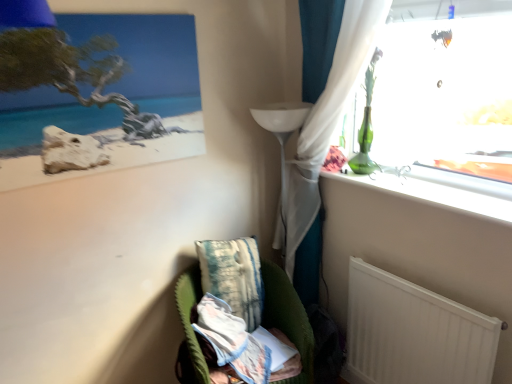
The height and width of the screenshot is (384, 512). Describe the element at coordinates (413, 333) in the screenshot. I see `white matte radiator at lower right` at that location.

Locate an element on the screen. The height and width of the screenshot is (384, 512). matte wooden picture frame at upper left is located at coordinates (99, 93).

At what (x,y) coordinates should I click in order to perform the action: click on velvet green armchair at lower center. Please return your answer as a coordinate pair (x, y). Looking at the image, I should click on (288, 317).

Where is `white matte radiator at lower right`? This screenshot has width=512, height=384. white matte radiator at lower right is located at coordinates (413, 333).

Is velvet green armchair at lower center located outside white matte radiator at lower right?

Yes, velvet green armchair at lower center is outside of white matte radiator at lower right.

Consider the image. Which of these two, velvet green armchair at lower center or white matte radiator at lower right, is wider?

With larger width is velvet green armchair at lower center.

Identify the location of radiator on the right of velvet green armchair at lower center. (413, 333).

Can you confirm if velvet green armchair at lower center is shorter than white matte radiator at lower right?

In fact, velvet green armchair at lower center may be taller than white matte radiator at lower right.

Is point (255, 276) behind point (95, 74)?

Yes, it is behind point (95, 74).

Considering the relative positions of textured teal pillow at lower center and matte wooden picture frame at upper left in the image provided, is textured teal pillow at lower center to the left of matte wooden picture frame at upper left from the viewer's perspective?

No, textured teal pillow at lower center is not to the left of matte wooden picture frame at upper left.

Is textured teal pillow at lower center far from matte wooden picture frame at upper left?

textured teal pillow at lower center is near matte wooden picture frame at upper left, not far away.

Is textured teal pillow at lower center spatially inside matte wooden picture frame at upper left, or outside of it?

textured teal pillow at lower center is not enclosed by matte wooden picture frame at upper left.

Can you tell me how much textured teal pillow at lower center and velvet green armchair at lower center differ in facing direction?

4.88 degrees separate the facing orientations of textured teal pillow at lower center and velvet green armchair at lower center.

In terms of width, does textured teal pillow at lower center look wider or thinner when compared to velvet green armchair at lower center?

Considering their sizes, textured teal pillow at lower center looks slimmer than velvet green armchair at lower center.

This screenshot has width=512, height=384. I want to click on pillow above the velvet green armchair at lower center (from a real-world perspective), so click(234, 276).

Which is more to the left, textured teal pillow at lower center or velvet green armchair at lower center?

From the viewer's perspective, textured teal pillow at lower center appears more on the left side.

The image size is (512, 384). Find the location of `radiator in front of the velvet green armchair at lower center`. radiator in front of the velvet green armchair at lower center is located at coordinates (413, 333).

Considering the relative positions of white matte radiator at lower right and velvet green armchair at lower center in the image provided, is white matte radiator at lower right in front of velvet green armchair at lower center?

Yes, it is in front of velvet green armchair at lower center.

Looking at this image, who is smaller, white matte radiator at lower right or velvet green armchair at lower center?

white matte radiator at lower right is smaller.

Measure the distance from textured teal pillow at lower center to white matte radiator at lower right.

textured teal pillow at lower center is 61.23 centimeters away from white matte radiator at lower right.

From a real-world perspective, is textured teal pillow at lower center beneath white matte radiator at lower right?

Incorrect, from a real-world perspective, textured teal pillow at lower center is higher than white matte radiator at lower right.

Can you tell me how much textured teal pillow at lower center and white matte radiator at lower right differ in facing direction?

66.8 degrees separate the facing orientations of textured teal pillow at lower center and white matte radiator at lower right.

Is textured teal pillow at lower center closer to the viewer compared to white matte radiator at lower right?

No.

Where is `pillow that is behind the white matte radiator at lower right`? pillow that is behind the white matte radiator at lower right is located at coordinates 234,276.

Is white matte radiator at lower right next to textured teal pillow at lower center and touching it?

No.

Which is nearer, (471, 334) or (241, 259)?

Positioned in front is point (471, 334).

Can we say white matte radiator at lower right lies outside textured teal pillow at lower center?

white matte radiator at lower right lies outside textured teal pillow at lower center's area.

Is point (122, 57) behind point (472, 347)?

Yes, it is behind point (472, 347).

Considering the sizes of objects matte wooden picture frame at upper left and white matte radiator at lower right in the image provided, who is bigger, matte wooden picture frame at upper left or white matte radiator at lower right?

matte wooden picture frame at upper left.

Is matte wooden picture frame at upper left not close to white matte radiator at lower right?

matte wooden picture frame at upper left is far away from white matte radiator at lower right.

From a real-world perspective, is matte wooden picture frame at upper left physically located above or below white matte radiator at lower right?

In terms of real-world spatial position, matte wooden picture frame at upper left is above white matte radiator at lower right.

The height and width of the screenshot is (384, 512). I want to click on radiator that appears in front of the velvet green armchair at lower center, so click(413, 333).

Where is `pillow below the matte wooden picture frame at upper left (from a real-world perspective)`? The height and width of the screenshot is (384, 512). pillow below the matte wooden picture frame at upper left (from a real-world perspective) is located at coordinates (234, 276).

From the image, which object appears to be farther from velvet green armchair at lower center, matte wooden picture frame at upper left or textured teal pillow at lower center?

matte wooden picture frame at upper left.

When comparing their distances from textured teal pillow at lower center, does velvet green armchair at lower center or matte wooden picture frame at upper left seem further?

matte wooden picture frame at upper left.

Considering their positions, is matte wooden picture frame at upper left positioned closer to textured teal pillow at lower center than velvet green armchair at lower center?

velvet green armchair at lower center is positioned closer to the anchor textured teal pillow at lower center.

Based on the photo, looking at the image, which one is located further to textured teal pillow at lower center, white matte radiator at lower right or matte wooden picture frame at upper left?

matte wooden picture frame at upper left.

When comparing their distances from textured teal pillow at lower center, does matte wooden picture frame at upper left or white matte radiator at lower right seem further?

Among the two, matte wooden picture frame at upper left is located further to textured teal pillow at lower center.

Estimate the real-world distances between objects in this image. Which object is closer to matte wooden picture frame at upper left, velvet green armchair at lower center or textured teal pillow at lower center?

Among the two, textured teal pillow at lower center is located nearer to matte wooden picture frame at upper left.

Based on their spatial positions, is matte wooden picture frame at upper left or textured teal pillow at lower center further from white matte radiator at lower right?

Among the two, matte wooden picture frame at upper left is located further to white matte radiator at lower right.

Which object lies further to the anchor point matte wooden picture frame at upper left, textured teal pillow at lower center or white matte radiator at lower right?

white matte radiator at lower right is positioned further to the anchor matte wooden picture frame at upper left.

Find the location of a particular element. The width and height of the screenshot is (512, 384). pillow between matte wooden picture frame at upper left and white matte radiator at lower right in the horizontal direction is located at coordinates (234, 276).

This screenshot has height=384, width=512. I want to click on pillow between matte wooden picture frame at upper left and velvet green armchair at lower center vertically, so click(234, 276).

You are a GUI agent. You are given a task and a screenshot of the screen. Output one action in this format:
    pyautogui.click(x=<x>, y=<y>)
    Task: Click on the furniture between textured teal pillow at lower center and white matte radiator at lower right from left to right
    Image resolution: width=512 pixels, height=384 pixels.
    Given the screenshot: What is the action you would take?
    pyautogui.click(x=288, y=317)

Image resolution: width=512 pixels, height=384 pixels. Identify the location of radiator between matte wooden picture frame at upper left and velvet green armchair at lower center in the up-down direction. (413, 333).